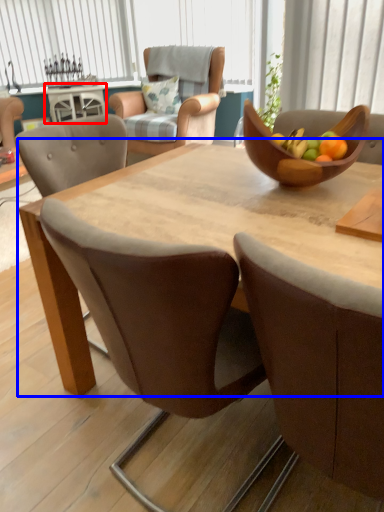
Question: Which object appears closest to the camera in this image, coffee table (highlighted by a red box) or round table (highlighted by a blue box)?

Choices:
 (A) coffee table
 (B) round table

Answer: (B)